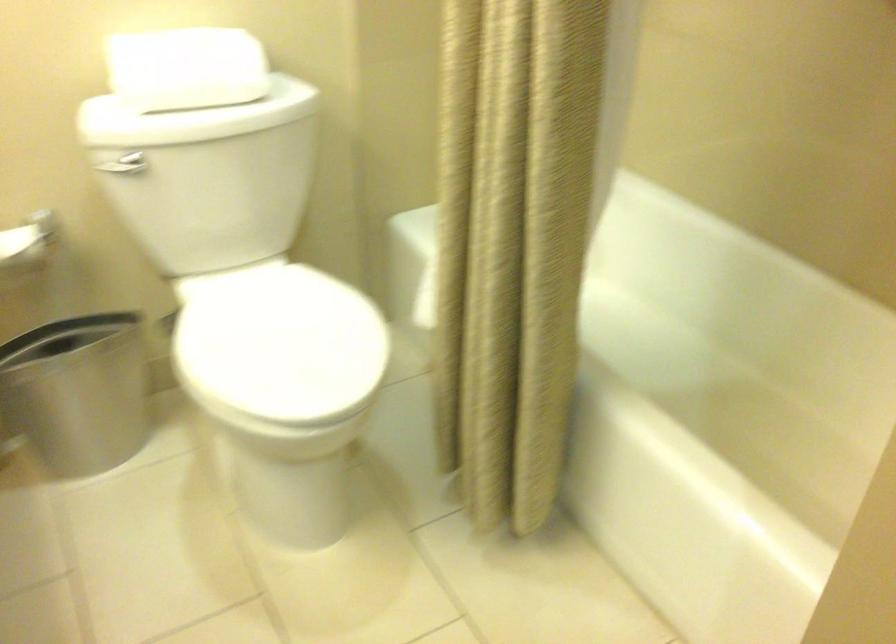
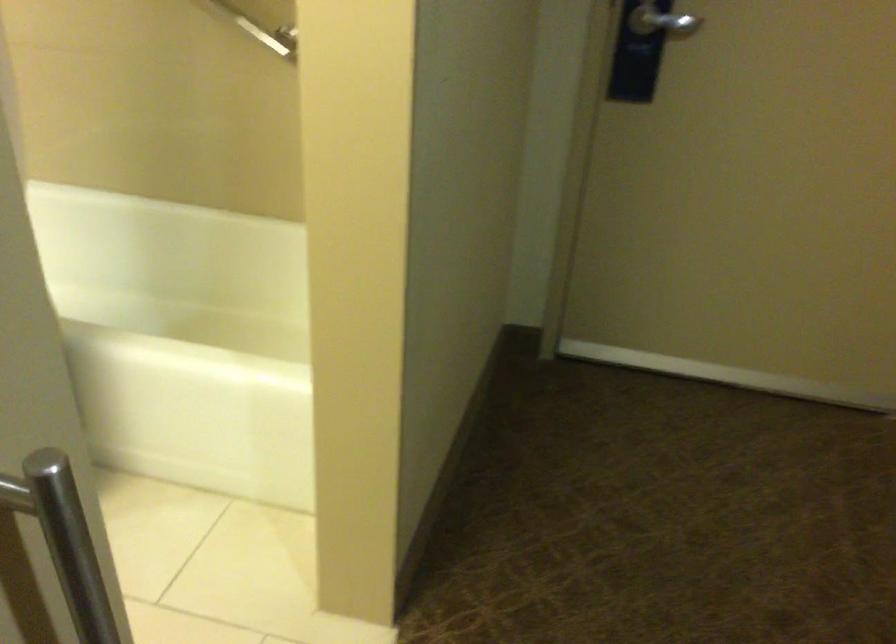
Question: The first image is from the beginning of the video and the second image is from the end. How did the camera likely rotate when shooting the video?

Choices:
 (A) Left
 (B) Right
 (C) Up
 (D) Down

Answer: (B)